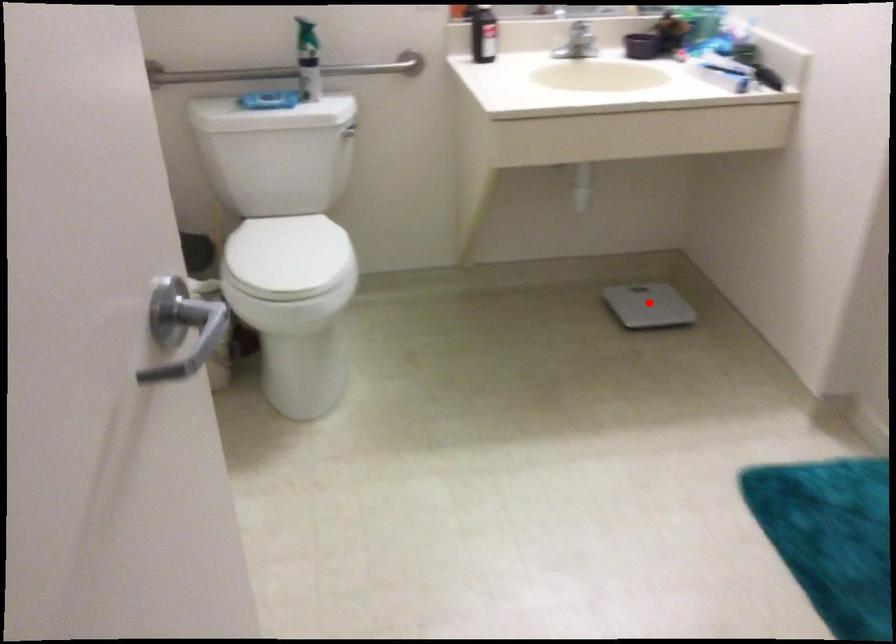
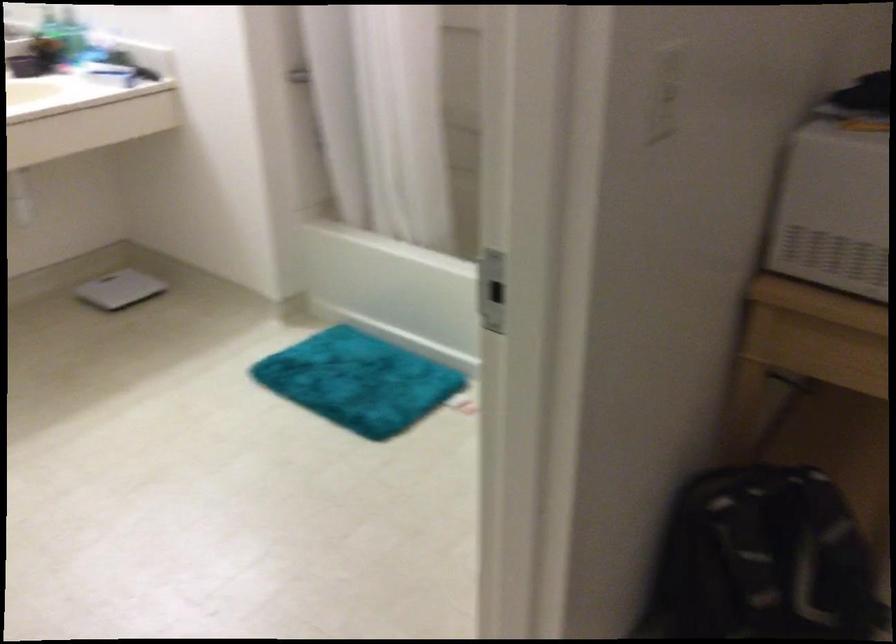
Question: I am providing you with two images of the same scene from different viewpoints. Image1 has a red point marked. In image2, the corresponding 3D location appears at what relative position? Reply with the corresponding letter.

Choices:
 (A) Closer
 (B) Farther

Answer: (B)